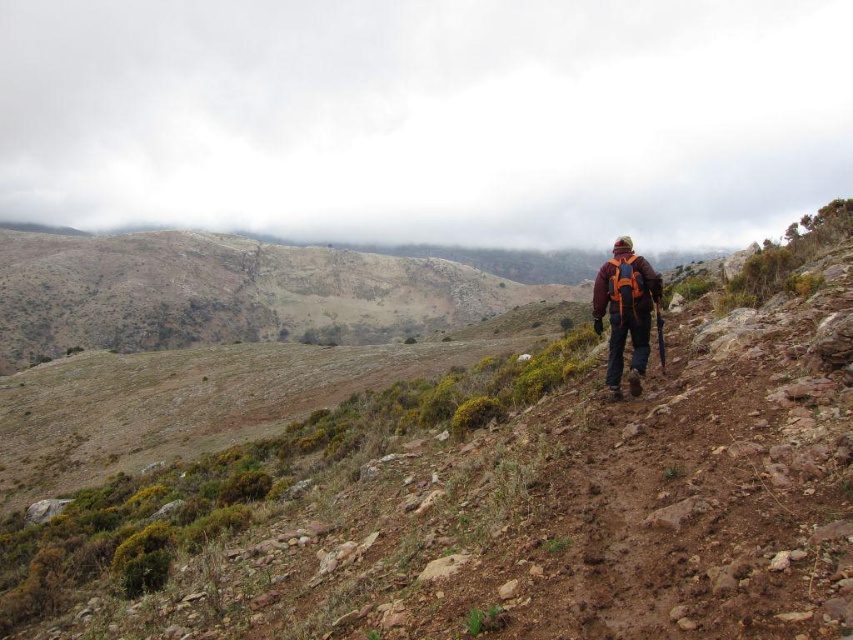
Can you confirm if cloudy sky at upper center is shorter than orange fabric backpack at right?

No, cloudy sky at upper center is not shorter than orange fabric backpack at right.

Who is shorter, cloudy sky at upper center or orange fabric backpack at right?

orange fabric backpack at right is shorter.

Which is behind, point (688, 148) or point (635, 310)?

Positioned behind is point (688, 148).

Where is `cloudy sky at upper center`? cloudy sky at upper center is located at coordinates tap(427, 116).